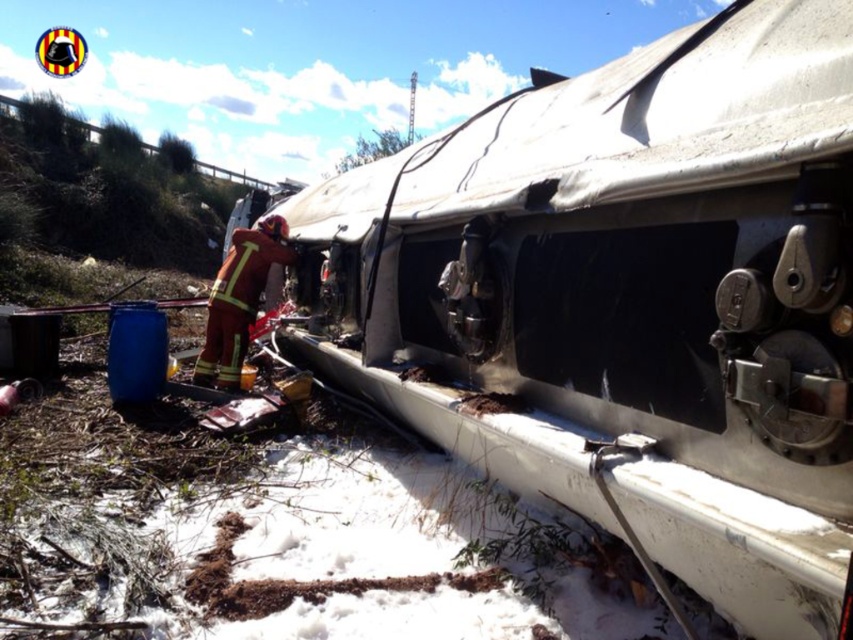
Which is in front, point (479, 314) or point (264, 227)?

Positioned in front is point (479, 314).

Between silver metallic train car at center and firefighter uniform at center, which one appears on the left side from the viewer's perspective?

firefighter uniform at center is more to the left.

Does point (796, 563) come behind point (267, 243)?

No, (796, 563) is in front of (267, 243).

Image resolution: width=853 pixels, height=640 pixels. Identify the location of silver metallic train car at center. (625, 300).